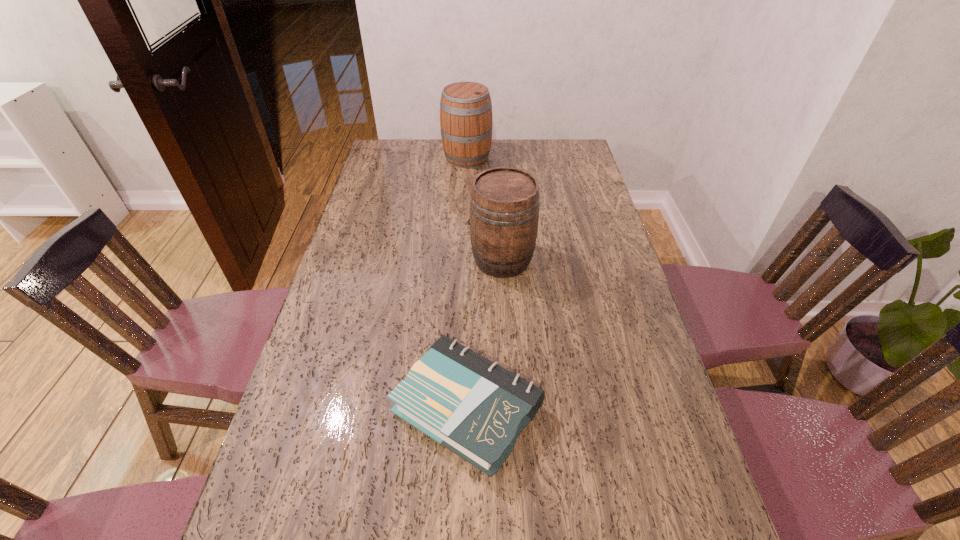
You are a GUI agent. You are given a task and a screenshot of the screen. Output one action in this format:
    pyautogui.click(x=<x>, y=<y>)
    Task: Click on the farther cider
    
    Given the screenshot: What is the action you would take?
    pyautogui.click(x=466, y=118)

You are a GUI agent. You are given a task and a screenshot of the screen. Output one action in this format:
    pyautogui.click(x=<x>, y=<y>)
    Task: Click on the nearer cider
    This screenshot has width=960, height=540.
    Given the screenshot: What is the action you would take?
    pyautogui.click(x=503, y=220)

Where is `the shortest object`? the shortest object is located at coordinates (472, 406).

The image size is (960, 540). Find the location of `paperback book`. paperback book is located at coordinates (472, 406).

Find the location of a particular element. free location located on the left of the farthest object is located at coordinates (404, 157).

This screenshot has width=960, height=540. In order to click on vacant region located 0.230m on the side of the nearer cider near the bung hole in this screenshot , I will do `click(396, 259)`.

Locate an element on the screen. free space located 0.400m on the side of the nearer cider near the bung hole is located at coordinates (344, 259).

Where is `free spot located 0.330m on the side of the nearer cider near the bung hole`? free spot located 0.330m on the side of the nearer cider near the bung hole is located at coordinates (365, 259).

Identify the location of vacant space located on the right of the paperback book. The image size is (960, 540). pos(629,408).

The image size is (960, 540). Find the location of `object that is at the far edge`. object that is at the far edge is located at coordinates (466, 118).